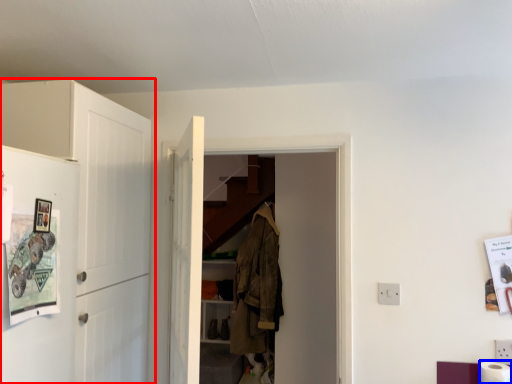
Question: Which object appears closest to the camera in this image, cabinetry (highlighted by a red box) or toilet paper (highlighted by a blue box)?

Choices:
 (A) cabinetry
 (B) toilet paper

Answer: (A)